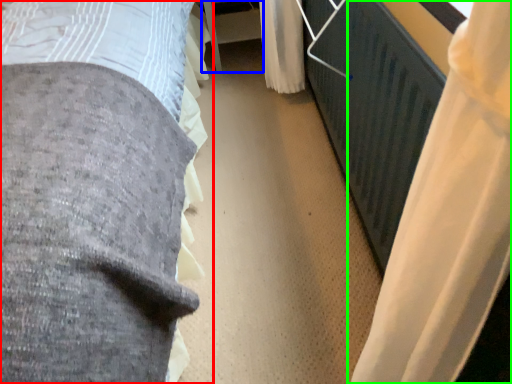
Question: Which object is the farthest from bed (highlighted by a red box)? Choose among these: table (highlighted by a blue box) or curtain (highlighted by a green box).

Choices:
 (A) table
 (B) curtain

Answer: (A)